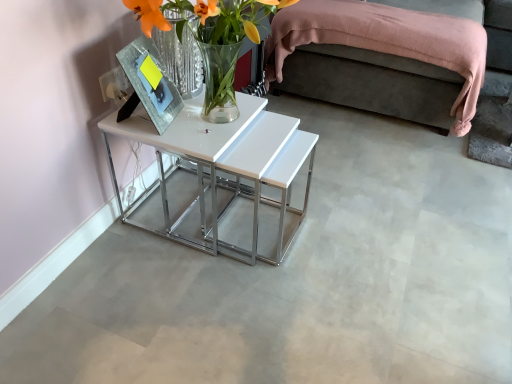
Identify the location of free point to the right of white glossy table at center. (346, 221).